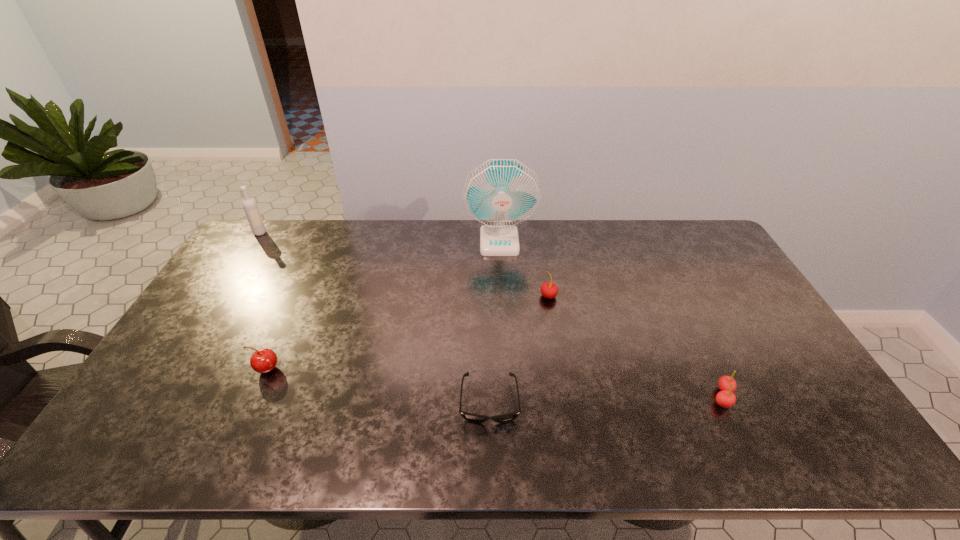
You are a GUI agent. You are given a task and a screenshot of the screen. Output one action in this format:
    pyautogui.click(x=<x>, y=<y>)
    Task: Click on the fan
    The width and height of the screenshot is (960, 540).
    Given the screenshot: What is the action you would take?
    pyautogui.click(x=500, y=194)

The width and height of the screenshot is (960, 540). In order to click on the leftmost object in this screenshot , I will do `click(250, 207)`.

You are a GUI agent. You are given a task and a screenshot of the screen. Output one action in this format:
    pyautogui.click(x=<x>, y=<y>)
    Task: Click on the fifth shortest object
    This screenshot has height=540, width=960.
    Given the screenshot: What is the action you would take?
    pyautogui.click(x=250, y=207)

The width and height of the screenshot is (960, 540). I want to click on the third farthest object, so click(x=549, y=290).

Locate an element on the screen. the third tallest object is located at coordinates (549, 290).

At what (x,y) coordinates should I click in order to perform the action: click on the fifth object from right to left. Please return your answer as a coordinate pair (x, y). The image size is (960, 540). Looking at the image, I should click on (264, 360).

Locate an element on the screen. the second nearest cherry is located at coordinates (264, 360).

Locate an element on the screen. the rightmost object is located at coordinates (725, 398).

You are a GUI agent. You are given a task and a screenshot of the screen. Output one action in this format:
    pyautogui.click(x=<x>, y=<y>)
    Task: Click on the nearest cherry
    This screenshot has width=960, height=540.
    Given the screenshot: What is the action you would take?
    pyautogui.click(x=725, y=398)

Identify the location of sunglasses. (476, 418).